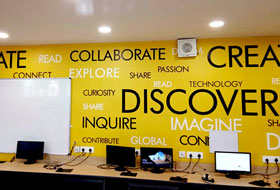
Where is `outlet`? This screenshot has height=190, width=280. outlet is located at coordinates (194, 156).